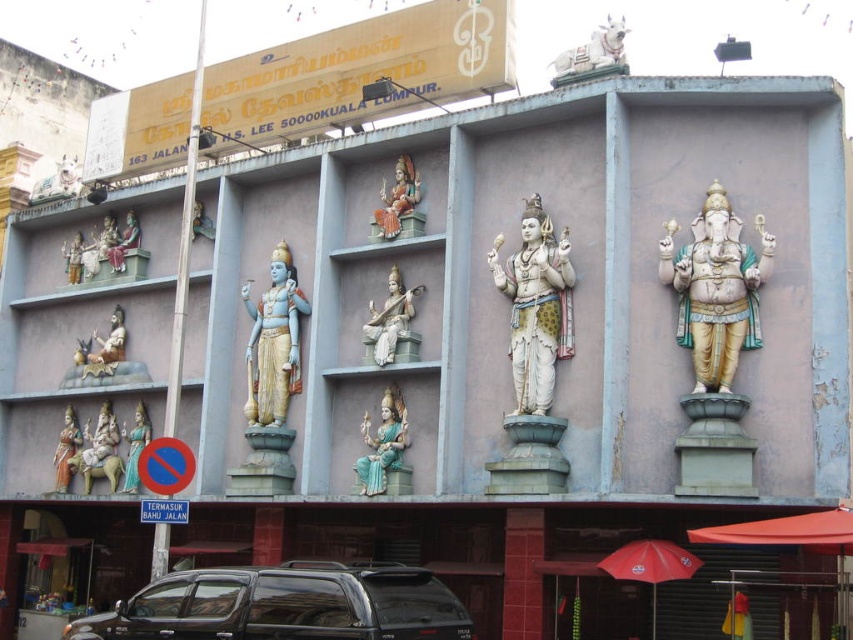
Based on the photo, you are standing at the camera position and want to take a photo of the matte gold statue at lower left. The statue is 3 meters tall. What is the minimum distance you need to move forward to ensure the statue fills the entire frame of your camera, which has a 50mm lens and a sensor size of 24mm x 36mm?

To calculate the minimum distance, use the formula distance equals focal length multiplied by subject height divided by sensor height. Plugging in the numbers, distance equals 50mm multiplied by 3 meters divided by 0.024 meters, resulting in approximately 6250 meters. However, this is impractical, so you should move as close as possible within the 72.58 meters to get the best possible shot.

You are standing at the entrance of the building and want to take a photo that includes both the matte gold statue at lower left and the white marble statue at upper left. Given that your camera has a maximum zoom range of 10 meters, will you be able to capture both statues in a single frame without moving closer?

The distance between the matte gold statue at lower left and the white marble statue at upper left is 17.49 meters. Since your camera can only zoom up to 10 meters, you won camera will not be able to capture both statues in a single frame without moving closer.